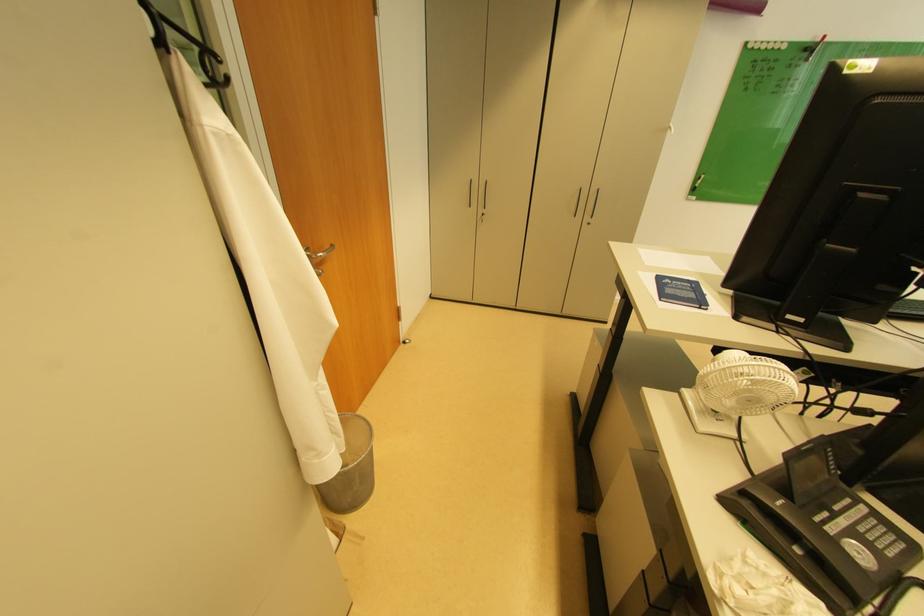
Where would you lift the metal trash can? Please return your answer as a coordinate pair (x, y).

(350, 468)